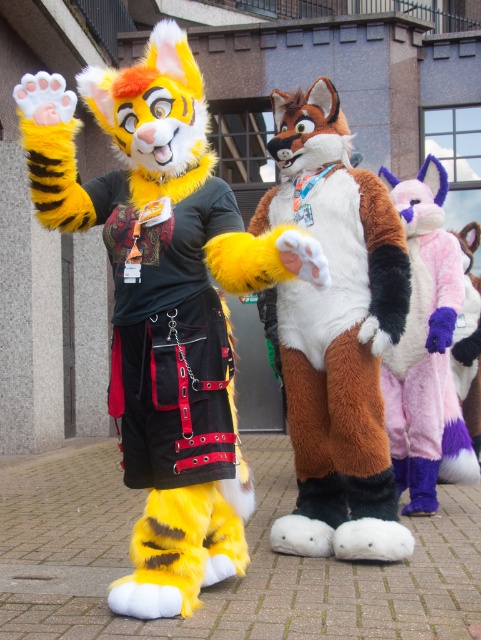
Can you confirm if fluffy yellow fur at center is positioned to the right of purple fuzzy coat at right?

No, fluffy yellow fur at center is not to the right of purple fuzzy coat at right.

Between point (188, 100) and point (458, 392), which one is positioned behind?

Positioned behind is point (458, 392).

Locate an element on the screen. The height and width of the screenshot is (640, 481). fluffy yellow fur at center is located at coordinates (164, 304).

You are a GUI agent. You are given a task and a screenshot of the screen. Output one action in this format:
    pyautogui.click(x=<x>, y=<y>)
    Task: Click on the fluffy yellow fur at center
    This screenshot has width=481, height=640.
    Given the screenshot: What is the action you would take?
    pyautogui.click(x=164, y=304)

Does brown fuzzy fox at center appear on the right side of purple fuzzy costume at right?

No, brown fuzzy fox at center is not to the right of purple fuzzy costume at right.

Which is in front, point (325, 404) or point (446, 360)?

Point (325, 404)

Find the location of a particular element. This screenshot has height=640, width=481. brown fuzzy fox at center is located at coordinates (337, 333).

Does brown fuzzy fox at center have a smaller size compared to purple fuzzy coat at right?

No, brown fuzzy fox at center is not smaller than purple fuzzy coat at right.

Which is behind, point (346, 520) or point (459, 314)?

The point (459, 314) is behind.

The height and width of the screenshot is (640, 481). What do you see at coordinates (337, 333) in the screenshot?
I see `brown fuzzy fox at center` at bounding box center [337, 333].

The width and height of the screenshot is (481, 640). In order to click on brown fuzzy fox at center in this screenshot , I will do pos(337,333).